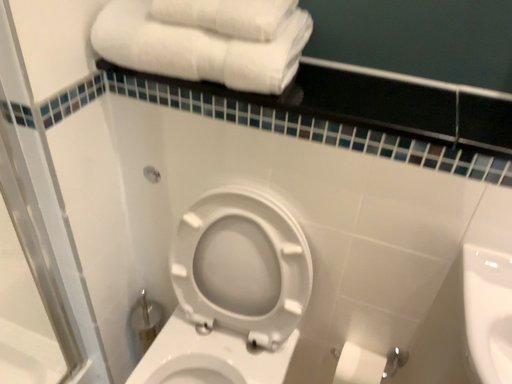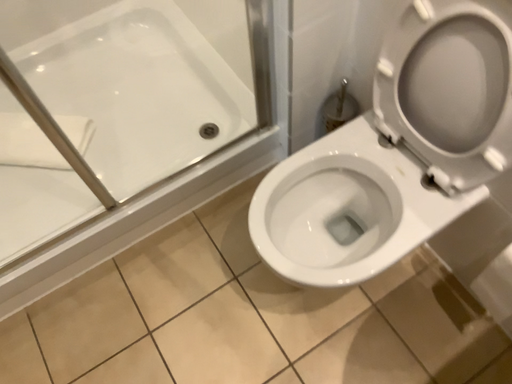
Question: Which way did the camera rotate in the video?

Choices:
 (A) rotated upward
 (B) rotated downward

Answer: (B)